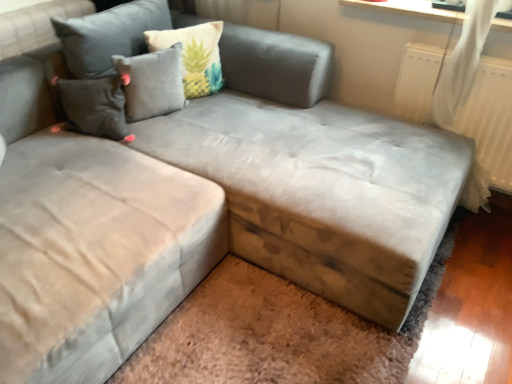
Where is `free point above brown wood storage at lower right (from a real-world perspective)`? The height and width of the screenshot is (384, 512). free point above brown wood storage at lower right (from a real-world perspective) is located at coordinates (287, 336).